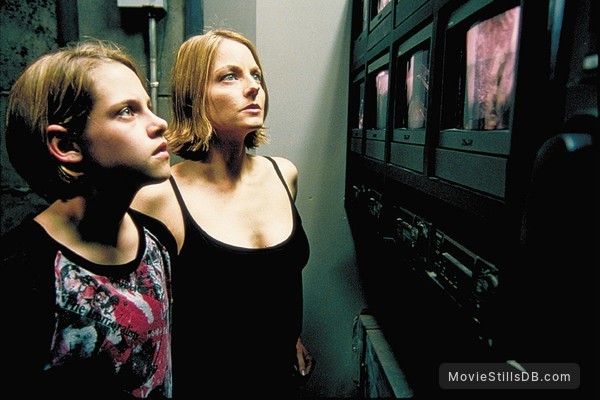
I want to click on wall, so click(x=313, y=167).